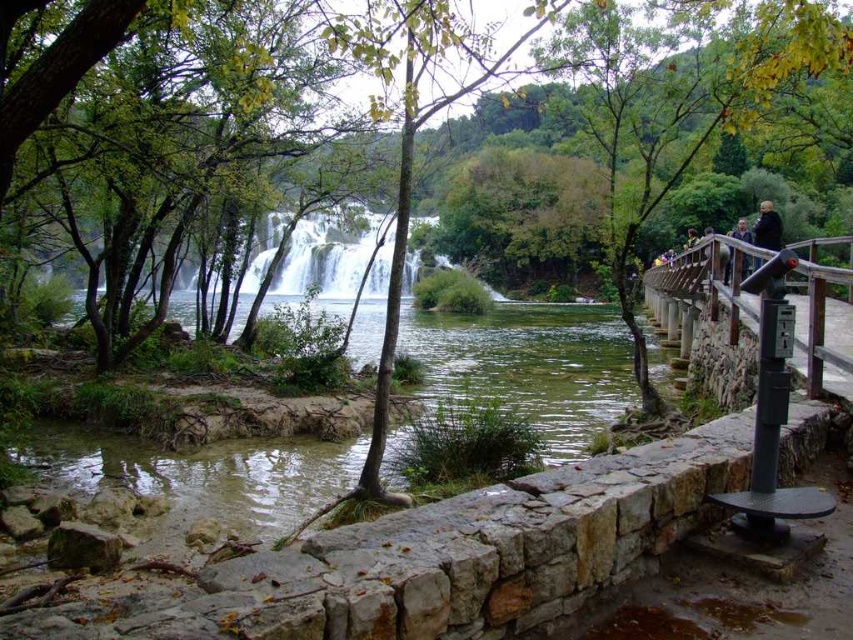
Question: Is brown wooden railing at right bigger than dark brown leather jacket at upper right?

Choices:
 (A) yes
 (B) no

Answer: (B)

Question: Can you confirm if clear water at center is bigger than brown wooden railing at right?

Choices:
 (A) yes
 (B) no

Answer: (A)

Question: Is the position of brown wooden railing at right less distant than that of dark brown leather jacket at upper right?

Choices:
 (A) yes
 (B) no

Answer: (A)

Question: Which point appears farthest from the camera in this image?

Choices:
 (A) (759, 244)
 (B) (425, 333)

Answer: (B)

Question: Which of the following is the farthest from the observer?

Choices:
 (A) (735, 324)
 (B) (753, 262)
 (C) (335, 275)
 (D) (509, 384)

Answer: (C)

Question: Among these points, which one is nearest to the camera?

Choices:
 (A) (379, 288)
 (B) (45, 456)

Answer: (B)